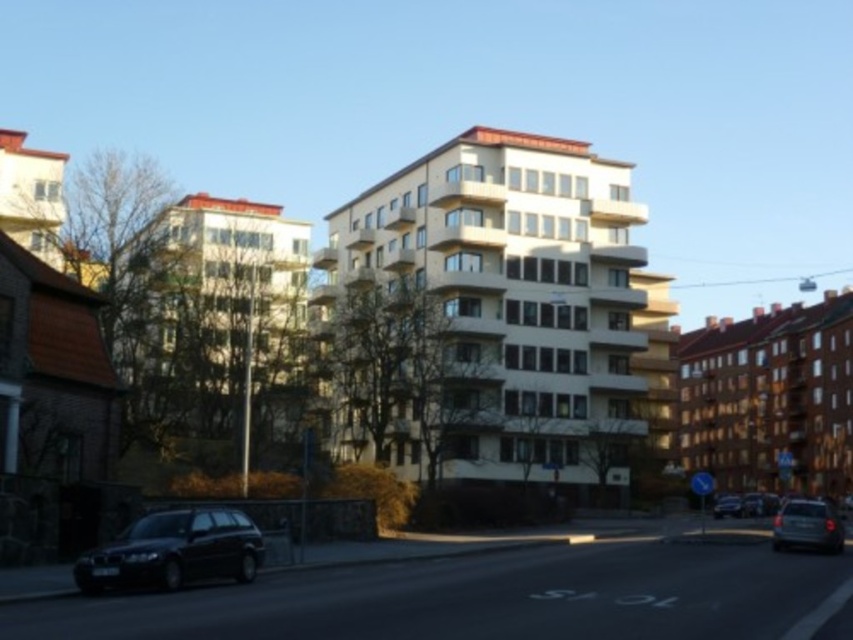
Is the position of metallic silver suv at lower right less distant than that of metallic silver car at center?

That is True.

Can you confirm if metallic silver suv at lower right is positioned above metallic silver car at center?

Yes, metallic silver suv at lower right is above metallic silver car at center.

Identify the location of metallic silver suv at lower right. (807, 525).

In the scene shown: Does shiny black car at lower left have a greater width compared to metallic silver car at center?

No.

Is point (206, 515) farther from viewer compared to point (717, 499)?

That is False.

The width and height of the screenshot is (853, 640). I want to click on shiny black car at lower left, so click(x=173, y=552).

Can you confirm if shiny black car at lower left is positioned to the left of metallic silver suv at lower right?

Correct, you'll find shiny black car at lower left to the left of metallic silver suv at lower right.

Is shiny black car at lower left positioned before metallic silver suv at lower right?

Yes, shiny black car at lower left is closer to the viewer.

What do you see at coordinates (173, 552) in the screenshot?
I see `shiny black car at lower left` at bounding box center [173, 552].

Locate an element on the screen. This screenshot has height=640, width=853. shiny black car at lower left is located at coordinates (173, 552).